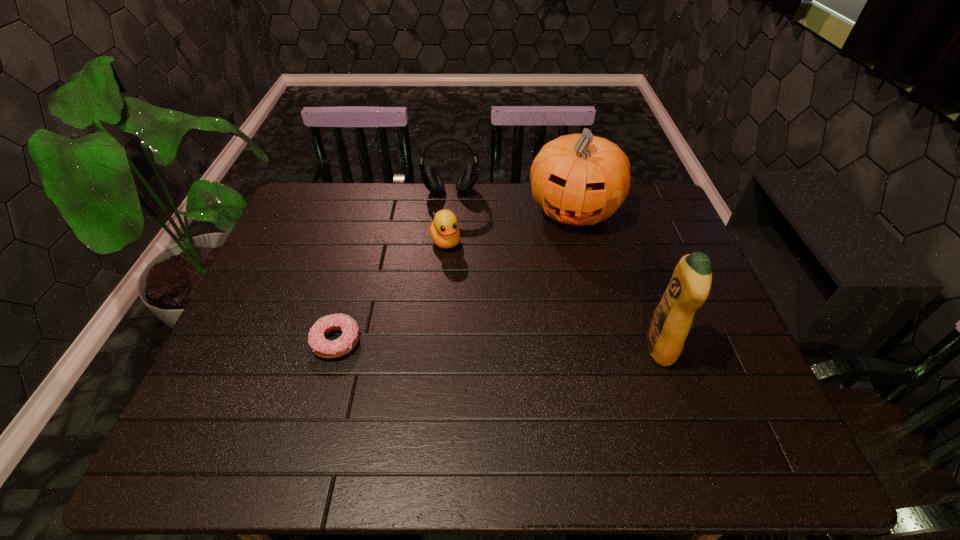
At what (x,y) coordinates should I click in order to perform the action: click on the shortest object. Please return your answer as a coordinate pair (x, y). Looking at the image, I should click on (320, 346).

You are a GUI agent. You are given a task and a screenshot of the screen. Output one action in this format:
    pyautogui.click(x=<x>, y=<y>)
    Task: Click on the doughnut
    The width and height of the screenshot is (960, 540).
    Given the screenshot: What is the action you would take?
    pyautogui.click(x=320, y=346)

What are the coordinates of `detergent` in the screenshot? It's located at (689, 287).

At what (x,y) coordinates should I click in order to perform the action: click on duckling. Please return your answer as a coordinate pair (x, y). This screenshot has height=540, width=960. Looking at the image, I should click on (444, 231).

This screenshot has width=960, height=540. What are the coordinates of `headset` in the screenshot? It's located at (431, 178).

Locate an element on the screen. pumpkin is located at coordinates (579, 179).

You are a GUI agent. You are given a task and a screenshot of the screen. Output one action in this format:
    pyautogui.click(x=<x>, y=<y>)
    Task: Click on the vacant space located on the right of the leftmost object
    The width and height of the screenshot is (960, 540).
    Given the screenshot: What is the action you would take?
    pyautogui.click(x=484, y=341)

The width and height of the screenshot is (960, 540). What are the coordinates of `vacant space situated on the label of the detergent` in the screenshot? It's located at (516, 347).

Image resolution: width=960 pixels, height=540 pixels. In order to click on free region located 0.210m on the label of the detergent in this screenshot , I will do `click(558, 347)`.

Find the location of a particular element. This screenshot has height=540, width=960. free space located on the label of the detergent is located at coordinates (545, 347).